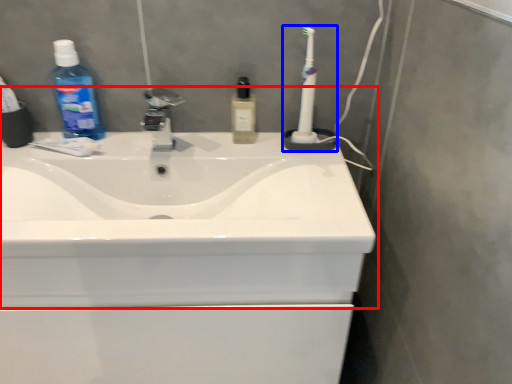
Question: Which object appears closest to the camera in this image, sink (highlighted by a red box) or toothbrush (highlighted by a blue box)?

Choices:
 (A) sink
 (B) toothbrush

Answer: (A)